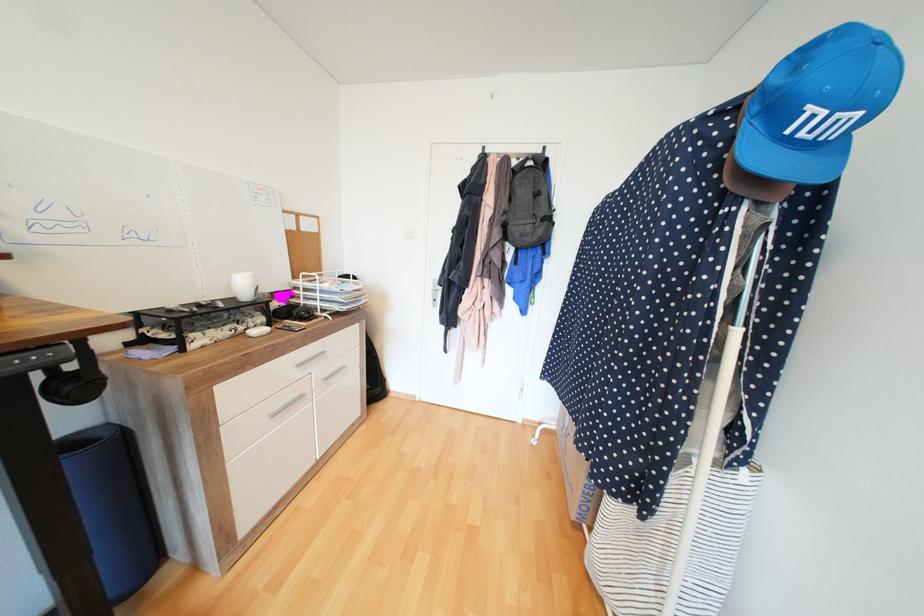
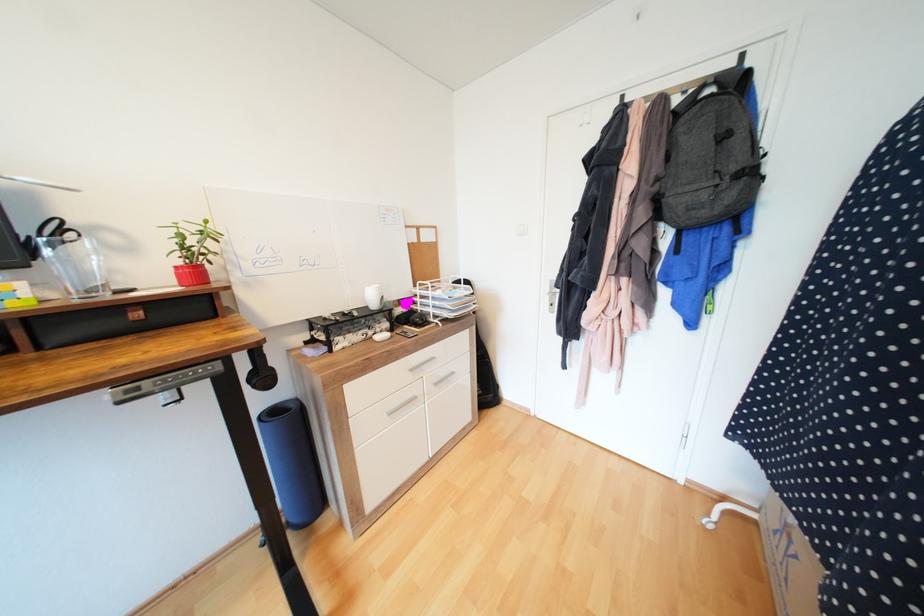
Question: The camera is either moving clockwise (left) or counter-clockwise (right) around the object. The first image is from the beginning of the video and the second image is from the end. Is the camera moving left or right when shooting the video?

Choices:
 (A) Left
 (B) Right

Answer: (B)